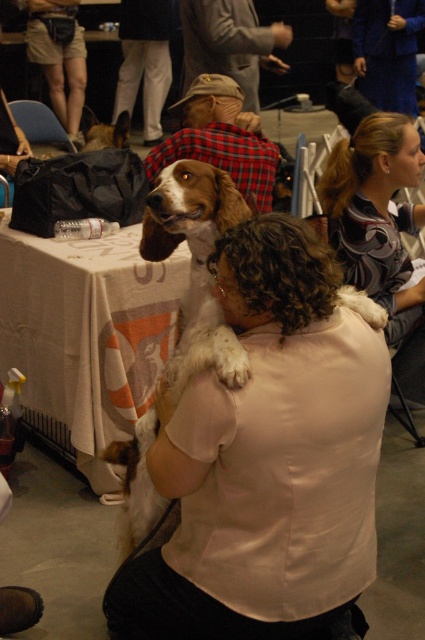
Who is more distant from viewer, (299, 586) or (206, 145)?

The point (206, 145) is more distant.

Image resolution: width=425 pixels, height=640 pixels. What do you see at coordinates (266, 458) in the screenshot?
I see `white satin shirt at center` at bounding box center [266, 458].

The width and height of the screenshot is (425, 640). In order to click on white satin shirt at center in this screenshot , I will do `click(266, 458)`.

Is white satin shirt at center wider than brown and white fur at center?

Indeed, white satin shirt at center has a greater width compared to brown and white fur at center.

Locate an element on the screen. The height and width of the screenshot is (640, 425). white satin shirt at center is located at coordinates (266, 458).

The width and height of the screenshot is (425, 640). I want to click on white satin shirt at center, so click(266, 458).

Does white satin shirt at center lie behind gray fabric jacket at upper center?

No, white satin shirt at center is in front of gray fabric jacket at upper center.

Image resolution: width=425 pixels, height=640 pixels. I want to click on white satin shirt at center, so [266, 458].

Does point (326, 372) come closer to viewer compared to point (223, 52)?

Yes, it is.

Where is `white satin shirt at center`? white satin shirt at center is located at coordinates (266, 458).